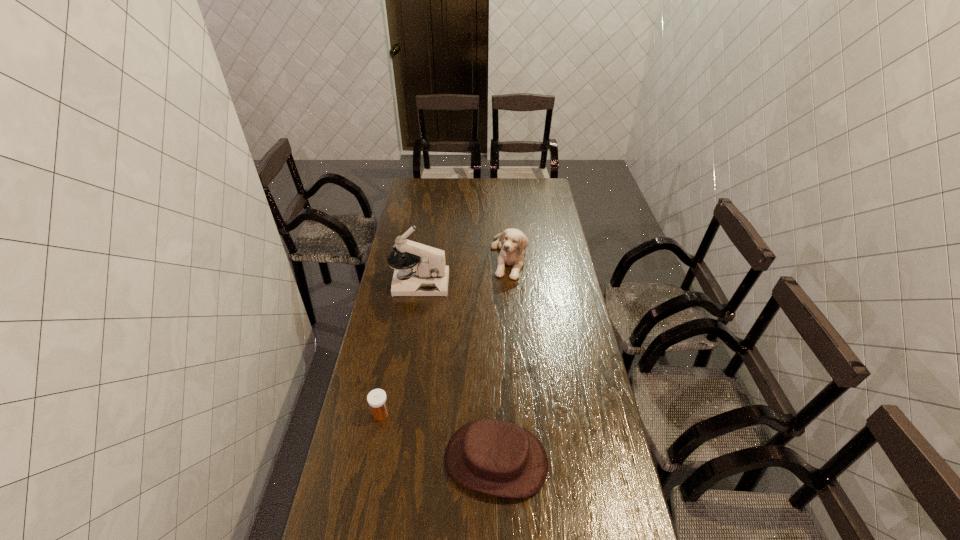
This screenshot has width=960, height=540. In order to click on vacant space that satisfies the following two spatial constraints: 1. at the eyepiece of the hat; 2. on the right side of the microscope in this screenshot , I will do `click(393, 461)`.

At what (x,y) coordinates should I click in order to perform the action: click on vacant space that satisfies the following two spatial constraints: 1. on the front side of the medicine; 2. on the right side of the third tallest object. Please return your answer as a coordinate pair (x, y). The image size is (960, 540). Looking at the image, I should click on (372, 461).

Locate an element on the screen. The height and width of the screenshot is (540, 960). free point that satisfies the following two spatial constraints: 1. at the eyepiece of the microscope; 2. on the front side of the second nearest object is located at coordinates (399, 414).

Find the location of `vacant area that satisfies the following two spatial constraints: 1. at the eyepiece of the microscope; 2. on the left side of the nearest object`. vacant area that satisfies the following two spatial constraints: 1. at the eyepiece of the microscope; 2. on the left side of the nearest object is located at coordinates (393, 461).